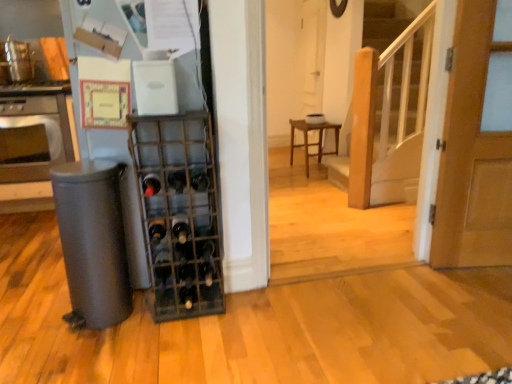
Identify the location of free spot in front of metallic wine rack at center. (176, 350).